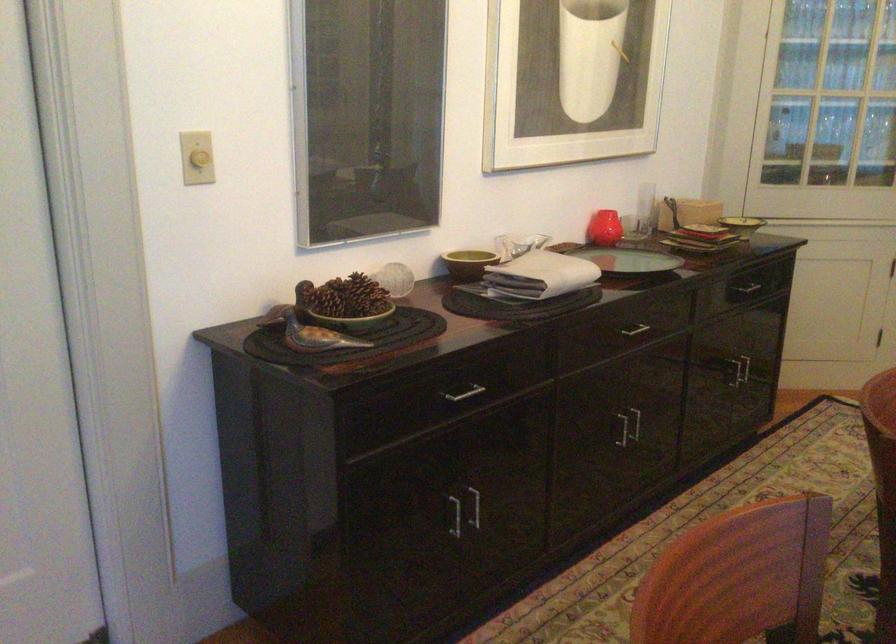
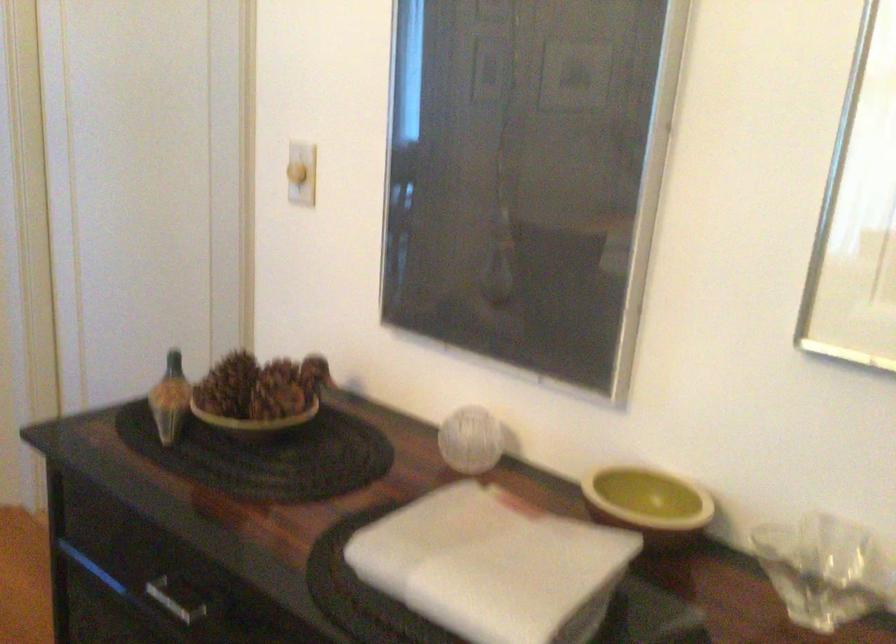
In the second image, find the point that corresponds to point (211, 145) in the first image.

(297, 173)